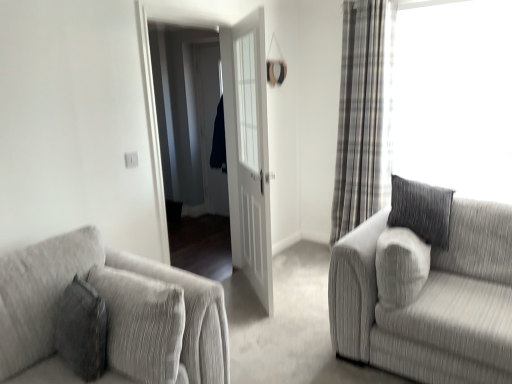
The image size is (512, 384). What do you see at coordinates (248, 151) in the screenshot? I see `white matte door at center` at bounding box center [248, 151].

Describe the element at coordinates (426, 288) in the screenshot. I see `textured gray couch at right, the 1th studio couch viewed from the right` at that location.

This screenshot has height=384, width=512. Describe the element at coordinates (106, 317) in the screenshot. I see `textured gray couch at lower left, the 2th studio couch in the right-to-left sequence` at that location.

Find the location of `white glossy door at center`. white glossy door at center is located at coordinates (247, 154).

Image resolution: width=512 pixels, height=384 pixels. What do you see at coordinates (247, 154) in the screenshot? I see `white glossy door at center` at bounding box center [247, 154].

Find the location of a particular element. The height and width of the screenshot is (384, 512). plaid fabric curtain at right is located at coordinates pyautogui.click(x=362, y=114).

Is white matte door at center touching textured gray couch at right, the 1th studio couch viewed from the right?

No, white matte door at center is not with textured gray couch at right, the 1th studio couch viewed from the right.

Is white matte door at center aimed at textured gray couch at right, the 1th studio couch viewed from the right?

No, white matte door at center is not turned towards textured gray couch at right, the 1th studio couch viewed from the right.

Based on the photo, from a real-world perspective, is white matte door at center on textured gray couch at right, the 1th studio couch viewed from the right?

Indeed, from a real-world perspective, white matte door at center stands above textured gray couch at right, the 1th studio couch viewed from the right.

From the picture: From the image's perspective, which one is positioned higher, textured gray couch at lower left, the 2th studio couch in the right-to-left sequence, or textured gray couch at right, the 1th studio couch viewed from the right?

textured gray couch at right, the 1th studio couch viewed from the right.

Locate an element on the screen. This screenshot has height=384, width=512. studio couch in front of the textured gray couch at right, the 1th studio couch viewed from the right is located at coordinates (106, 317).

Between point (51, 241) and point (414, 345), which one is positioned in front?

The point (51, 241) is closer.

Find the location of a particular element. curtain that is behind the white matte door at center is located at coordinates coord(362,114).

Considering the sizes of white matte door at center and plaid fabric curtain at right in the image, is white matte door at center bigger or smaller than plaid fabric curtain at right?

Clearly, white matte door at center is smaller in size than plaid fabric curtain at right.

Which object is thinner, white matte door at center or plaid fabric curtain at right?

Thinner between the two is white matte door at center.

Choose the correct answer: Is white matte door at center inside textured gray couch at lower left, the 2th studio couch in the right-to-left sequence, or outside it?

white matte door at center is not enclosed by textured gray couch at lower left, the 2th studio couch in the right-to-left sequence.

Which is more to the left, white matte door at center or textured gray couch at lower left, which ranks as the first studio couch in left-to-right order?

textured gray couch at lower left, which ranks as the first studio couch in left-to-right order, is more to the left.

Is white matte door at center further to the viewer compared to textured gray couch at lower left, the 2th studio couch in the right-to-left sequence?

Yes, it is behind textured gray couch at lower left, the 2th studio couch in the right-to-left sequence.

Which of these two, white matte door at center or textured gray couch at lower left, which ranks as the first studio couch in left-to-right order, stands shorter?

With less height is textured gray couch at lower left, which ranks as the first studio couch in left-to-right order.

Is textured gray couch at right, placed as the 2th studio couch when sorted from left to right, closer to the viewer compared to white glossy door at center?

Yes, textured gray couch at right, placed as the 2th studio couch when sorted from left to right, is closer to the camera.

Which is less distant, (419, 353) or (234, 42)?

Point (419, 353) is closer to the camera than point (234, 42).

Who is smaller, textured gray couch at right, the 1th studio couch viewed from the right, or white glossy door at center?

white glossy door at center is smaller.

Is textured gray couch at right, placed as the 2th studio couch when sorted from left to right, positioned far away from white glossy door at center?

Yes, textured gray couch at right, placed as the 2th studio couch when sorted from left to right, and white glossy door at center are quite far apart.

Could you measure the distance between textured gray couch at right, placed as the 2th studio couch when sorted from left to right, and textured gray couch at lower left, the 2th studio couch in the right-to-left sequence?

A distance of 1.13 meters exists between textured gray couch at right, placed as the 2th studio couch when sorted from left to right, and textured gray couch at lower left, the 2th studio couch in the right-to-left sequence.

Considering the positions of objects textured gray couch at right, placed as the 2th studio couch when sorted from left to right, and textured gray couch at lower left, which ranks as the first studio couch in left-to-right order, in the image provided, who is behind, textured gray couch at right, placed as the 2th studio couch when sorted from left to right, or textured gray couch at lower left, which ranks as the first studio couch in left-to-right order,?

textured gray couch at right, placed as the 2th studio couch when sorted from left to right, is behind.

This screenshot has height=384, width=512. I want to click on studio couch behind the textured gray couch at lower left, the 2th studio couch in the right-to-left sequence, so click(426, 288).

Looking at this image, is there a large distance between textured gray couch at right, the 1th studio couch viewed from the right, and textured gray couch at lower left, which ranks as the first studio couch in left-to-right order?

That's right, there is a large distance between textured gray couch at right, the 1th studio couch viewed from the right, and textured gray couch at lower left, which ranks as the first studio couch in left-to-right order.

From a real-world perspective, is white matte door at center below white glossy door at center?

Yes, from a real-world perspective, white matte door at center is below white glossy door at center.

Measure the distance from white matte door at center to white glossy door at center.

They are 3.71 centimeters apart.

Can you confirm if white matte door at center is shorter than white glossy door at center?

Yes, white matte door at center is shorter than white glossy door at center.

Visually, is white matte door at center positioned to the left or to the right of white glossy door at center?

white matte door at center is to the right of white glossy door at center.

Find the location of a particular element. The width and height of the screenshot is (512, 384). studio couch on the right of the white matte door at center is located at coordinates (426, 288).

Find the location of a particular element. The height and width of the screenshot is (384, 512). studio couch above the textured gray couch at right, the 1th studio couch viewed from the right (from a real-world perspective) is located at coordinates (106, 317).

Based on the photo, which object lies nearer to the anchor point textured gray couch at lower left, the 2th studio couch in the right-to-left sequence, white glossy door at center or plaid fabric curtain at right?

white glossy door at center is positioned closer to the anchor textured gray couch at lower left, the 2th studio couch in the right-to-left sequence.

When comparing their distances from textured gray couch at lower left, the 2th studio couch in the right-to-left sequence, does plaid fabric curtain at right or white glossy door at center seem closer?

white glossy door at center.

Estimate the real-world distances between objects in this image. Which object is closer to textured gray couch at right, placed as the 2th studio couch when sorted from left to right, white glossy door at center or textured gray couch at lower left, the 2th studio couch in the right-to-left sequence?

white glossy door at center is closer to textured gray couch at right, placed as the 2th studio couch when sorted from left to right.

Based on their spatial positions, is textured gray couch at lower left, the 2th studio couch in the right-to-left sequence, or textured gray couch at right, the 1th studio couch viewed from the right, further from white glossy door at center?

textured gray couch at lower left, the 2th studio couch in the right-to-left sequence, is further to white glossy door at center.

Based on the photo, considering their positions, is textured gray couch at right, placed as the 2th studio couch when sorted from left to right, positioned closer to white matte door at center than textured gray couch at lower left, which ranks as the first studio couch in left-to-right order?

Based on the image, textured gray couch at right, placed as the 2th studio couch when sorted from left to right, appears to be nearer to white matte door at center.

Estimate the real-world distances between objects in this image. Which object is further from textured gray couch at lower left, which ranks as the first studio couch in left-to-right order, plaid fabric curtain at right or white matte door at center?

plaid fabric curtain at right.

When comparing their distances from plaid fabric curtain at right, does textured gray couch at lower left, which ranks as the first studio couch in left-to-right order, or white matte door at center seem closer?

Based on the image, white matte door at center appears to be nearer to plaid fabric curtain at right.

From the image, which object appears to be nearer to white glossy door at center, plaid fabric curtain at right or textured gray couch at right, the 1th studio couch viewed from the right?

plaid fabric curtain at right lies closer to white glossy door at center than the other object.

The width and height of the screenshot is (512, 384). Find the location of `door between white glossy door at center and textured gray couch at right, the 1th studio couch viewed from the right`. door between white glossy door at center and textured gray couch at right, the 1th studio couch viewed from the right is located at coordinates (248, 151).

Identify the location of door between white glossy door at center and plaid fabric curtain at right in the horizontal direction. This screenshot has height=384, width=512. point(248,151).

Find the location of `door located between textured gray couch at lower left, which ranks as the first studio couch in left-to-right order, and textured gray couch at right, the 1th studio couch viewed from the right, in the left-right direction`. door located between textured gray couch at lower left, which ranks as the first studio couch in left-to-right order, and textured gray couch at right, the 1th studio couch viewed from the right, in the left-right direction is located at coordinates (248, 151).

You are a GUI agent. You are given a task and a screenshot of the screen. Output one action in this format:
    pyautogui.click(x=<x>, y=<y>)
    Task: Click on the door between textured gray couch at lower left, the 2th studio couch in the right-to-left sequence, and plaid fabric curtain at right, along the z-axis
    The height and width of the screenshot is (384, 512).
    Given the screenshot: What is the action you would take?
    pyautogui.click(x=248, y=151)